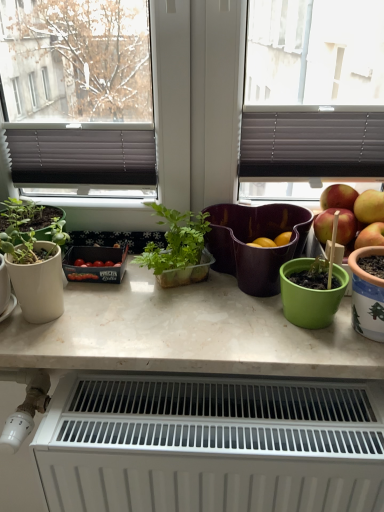
Where is `vacant area that lies in front of translucent plastic plant at center`? This screenshot has height=512, width=384. vacant area that lies in front of translucent plastic plant at center is located at coordinates (181, 330).